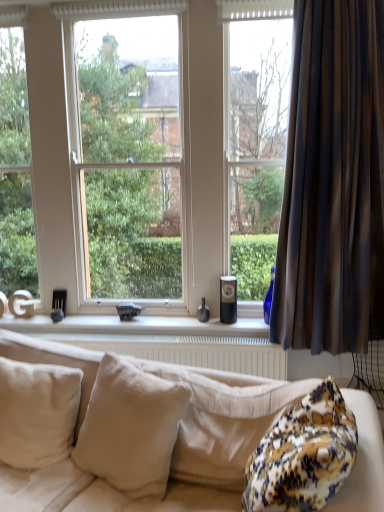
Question: Is white textured radiator at lower center thinner than white matte window sill at center?

Choices:
 (A) yes
 (B) no

Answer: (A)

Question: From a real-world perspective, is white textured radiator at lower center positioned over white matte window sill at center based on gravity?

Choices:
 (A) no
 (B) yes

Answer: (A)

Question: Is white textured radiator at lower center in contact with white matte window sill at center?

Choices:
 (A) no
 (B) yes

Answer: (A)

Question: Is white textured radiator at lower center not inside white matte window sill at center?

Choices:
 (A) no
 (B) yes

Answer: (B)

Question: Is white textured radiator at lower center positioned with its back to white matte window sill at center?

Choices:
 (A) no
 (B) yes

Answer: (A)

Question: Considering the positions of transparent glass window at center and brown striped curtain at right in the image, is transparent glass window at center taller or shorter than brown striped curtain at right?

Choices:
 (A) short
 (B) tall

Answer: (B)

Question: From a real-world perspective, is transparent glass window at center physically located above or below brown striped curtain at right?

Choices:
 (A) above
 (B) below

Answer: (A)

Question: From the image's perspective, is transparent glass window at center located above or below brown striped curtain at right?

Choices:
 (A) above
 (B) below

Answer: (A)

Question: Looking at their shapes, would you say transparent glass window at center is wider or thinner than brown striped curtain at right?

Choices:
 (A) thin
 (B) wide

Answer: (B)

Question: Based on their positions, is white matte window sill at center located to the left or right of brown striped curtain at right?

Choices:
 (A) left
 (B) right

Answer: (A)

Question: In terms of height, does white matte window sill at center look taller or shorter compared to brown striped curtain at right?

Choices:
 (A) short
 (B) tall

Answer: (A)

Question: Based on their sizes in the image, would you say white matte window sill at center is bigger or smaller than brown striped curtain at right?

Choices:
 (A) small
 (B) big

Answer: (A)

Question: From a real-world perspective, is white matte window sill at center above or below brown striped curtain at right?

Choices:
 (A) above
 (B) below

Answer: (B)

Question: Is beige fabric pillow at center, arranged as the first pillow when viewed from the right, spatially inside transparent glass window at center, or outside of it?

Choices:
 (A) outside
 (B) inside

Answer: (A)

Question: From a real-world perspective, is beige fabric pillow at center, arranged as the first pillow when viewed from the right, above or below transparent glass window at center?

Choices:
 (A) below
 (B) above

Answer: (A)